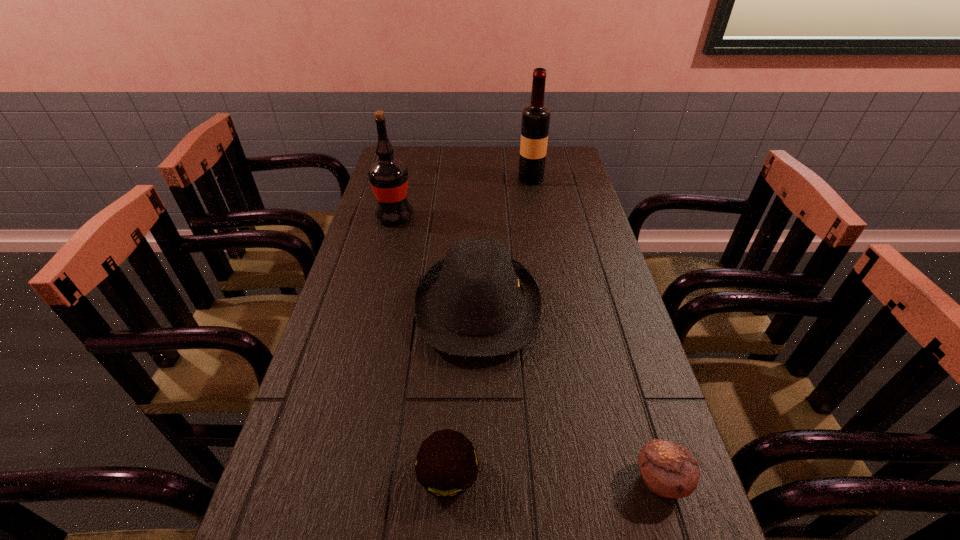
Identify which object is located as the fourth nearest to the muffin. Please provide its 2D coordinates. Your answer should be formatted as a tuple, i.e. [(x, y)], where the tuple contains the x and y coordinates of a point satisfying the conditions above.

[(535, 117)]

Point out which object is positioned as the second nearest to the patty. Please provide its 2D coordinates. Your answer should be formatted as a tuple, i.e. [(x, y)], where the tuple contains the x and y coordinates of a point satisfying the conditions above.

[(668, 469)]

Find the location of a particular element. This screenshot has height=540, width=960. vacant region that satisfies the following two spatial constraints: 1. on the front side of the muffin; 2. on the left side of the patty is located at coordinates [x=447, y=480].

Find the location of `vacant space that satisfies the following two spatial constraints: 1. on the back side of the nearer wine bottle; 2. on the left side of the farther wine bottle`. vacant space that satisfies the following two spatial constraints: 1. on the back side of the nearer wine bottle; 2. on the left side of the farther wine bottle is located at coordinates (404, 179).

Locate an element on the screen. The image size is (960, 540). free space that satisfies the following two spatial constraints: 1. on the front side of the nearer wine bottle; 2. on the right side of the muffin is located at coordinates (328, 480).

Identify the location of free space that satisfies the following two spatial constraints: 1. on the front-facing side of the fedora; 2. on the left side of the rightmost object. The width and height of the screenshot is (960, 540). (477, 480).